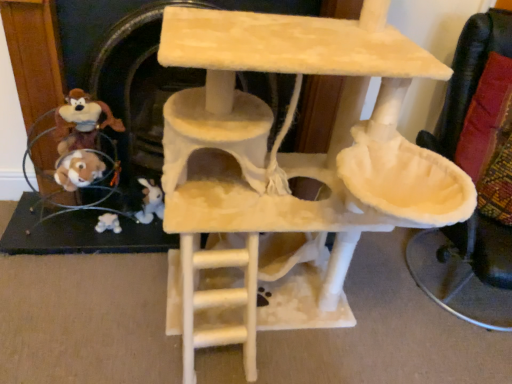
Where is `vacant space that is to the left of beige felt cat tree at center`? vacant space that is to the left of beige felt cat tree at center is located at coordinates (95, 310).